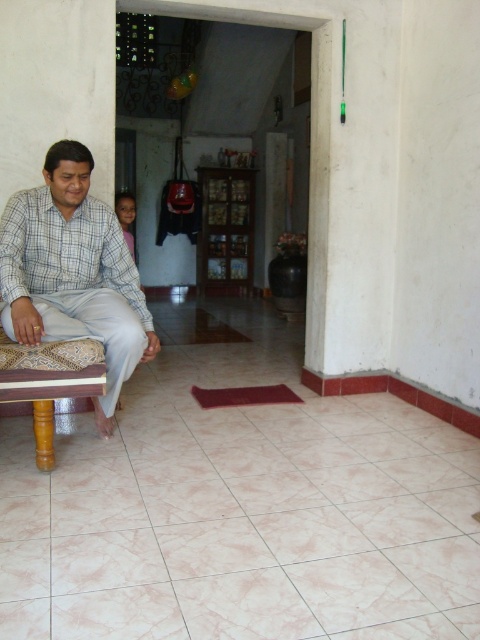
Based on the photo, you are standing in the room shown in the image. Where is the checkered fabric shirt at left located in terms of its 2D coordinates?

The checkered fabric shirt at left is located at the 2D coordinates of point (x=72, y=273).

You are a delivery person trying to place a small package between the checkered fabric shirt at left and the wooden stool at left. The package is 12 inches long. Can you fit it in the space between them?

The checkered fabric shirt at left and wooden stool at left are 12.17 inches apart, so the 12 inch package can fit between them since it is slightly narrower than the available space.